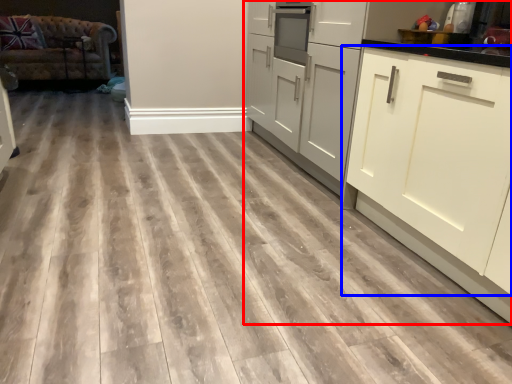
Question: Which of the following is the farthest to the observer, cabinetry (highlighted by a red box) or cabinetry (highlighted by a blue box)?

Choices:
 (A) cabinetry
 (B) cabinetry

Answer: (B)